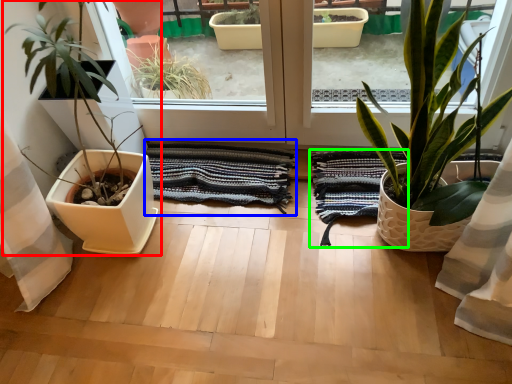
Question: Based on their relative distances, which object is farther from houseplant (highlighted by a red box)? Choose from bath towel (highlighted by a blue box) and bath towel (highlighted by a green box).

Choices:
 (A) bath towel
 (B) bath towel

Answer: (B)